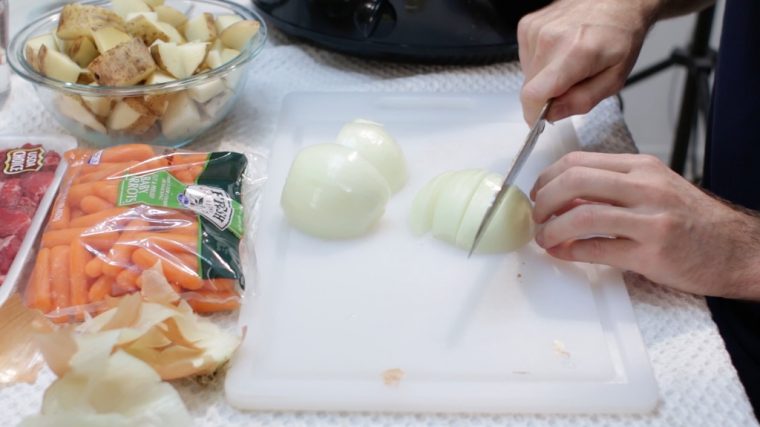
Identify the location of cutting board. This screenshot has width=760, height=427. (515, 357).